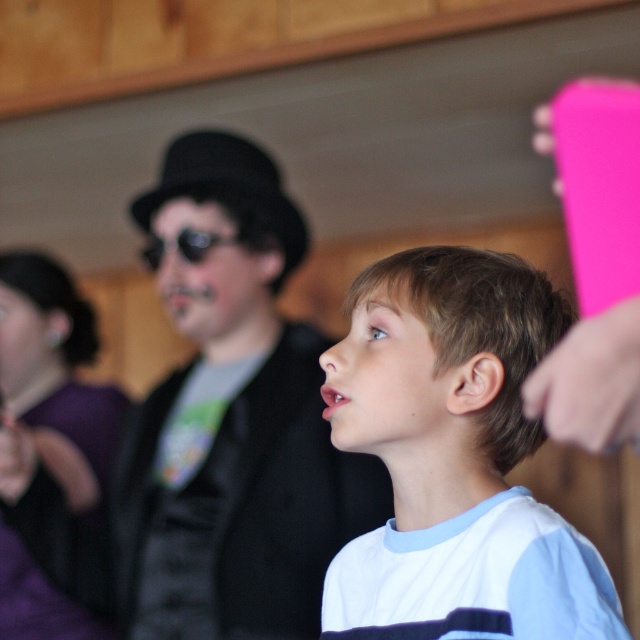
Does black matte hat at center appear on the right side of black reflective sunglasses at center?

Correct, you'll find black matte hat at center to the right of black reflective sunglasses at center.

Is black matte hat at center wider than black reflective sunglasses at center?

Yes, black matte hat at center is wider than black reflective sunglasses at center.

Does point (266, 198) come behind point (211, 241)?

Yes.

Find the location of a particular element. black matte hat at center is located at coordinates (232, 422).

Which is below, white matte shirt at center or black reflective sunglasses at center?

white matte shirt at center

This screenshot has height=640, width=640. Describe the element at coordinates (454, 458) in the screenshot. I see `white matte shirt at center` at that location.

Who is more forward, (385, 449) or (195, 256)?

Point (385, 449) is more forward.

Locate an element on the screen. This screenshot has height=640, width=640. white matte shirt at center is located at coordinates (454, 458).

Who is more distant from viewer, [275,221] or [346,579]?

The point [275,221] is behind.

Does point (257, 480) come in front of point (512, 314)?

No.

I want to click on black matte hat at center, so click(232, 422).